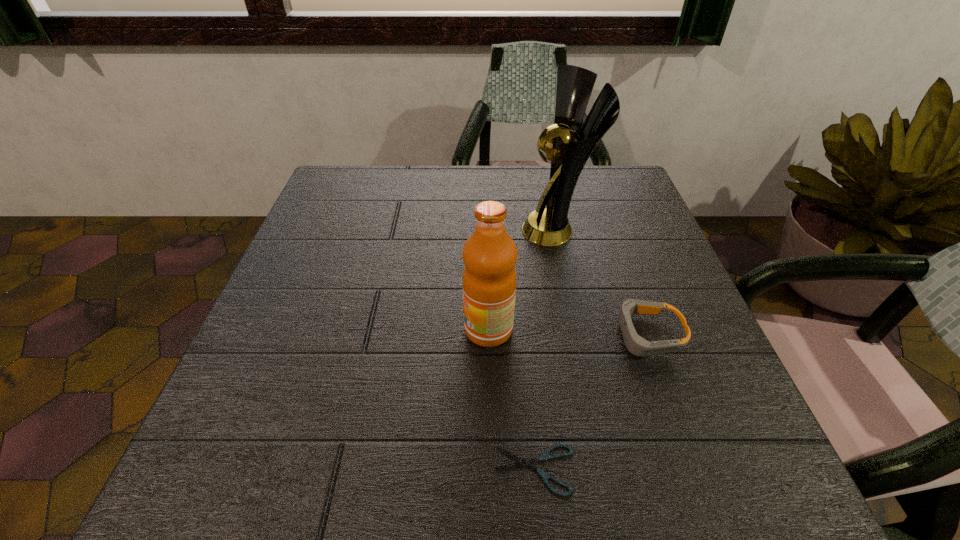
This screenshot has width=960, height=540. I want to click on free spot between the tallest object and the third shortest object, so click(x=523, y=280).

Image resolution: width=960 pixels, height=540 pixels. What are the coordinates of `blank region between the third tallest object and the farthest object` in the screenshot? It's located at (602, 282).

In order to click on vacant point located between the tallest object and the fruit juice in this screenshot , I will do `click(523, 280)`.

Where is `vacant space in between the shears and the award`? Image resolution: width=960 pixels, height=540 pixels. vacant space in between the shears and the award is located at coordinates (545, 349).

At what (x,y) coordinates should I click in order to perform the action: click on free space between the fruit juice and the nearest object. Please return your answer as a coordinate pair (x, y). Looking at the image, I should click on (512, 400).

Find the location of a particular element. The height and width of the screenshot is (540, 960). free space between the farthest object and the second tallest object is located at coordinates (523, 280).

Where is `free point between the goggles and the award`? Image resolution: width=960 pixels, height=540 pixels. free point between the goggles and the award is located at coordinates click(602, 282).

Locate which object is the closest to the shears. Please provide its 2D coordinates. Your answer should be formatted as a tuple, i.e. [(x, y)], where the tuple contains the x and y coordinates of a point satisfying the conditions above.

[(489, 280)]

Identify the location of the second closest object to the award. The height and width of the screenshot is (540, 960). (489, 280).

Where is `vacant region that satisfies the following two spatial constraints: 1. on the back side of the shortest object; 2. on the label side of the second tallest object`? Image resolution: width=960 pixels, height=540 pixels. vacant region that satisfies the following two spatial constraints: 1. on the back side of the shortest object; 2. on the label side of the second tallest object is located at coordinates point(522,329).